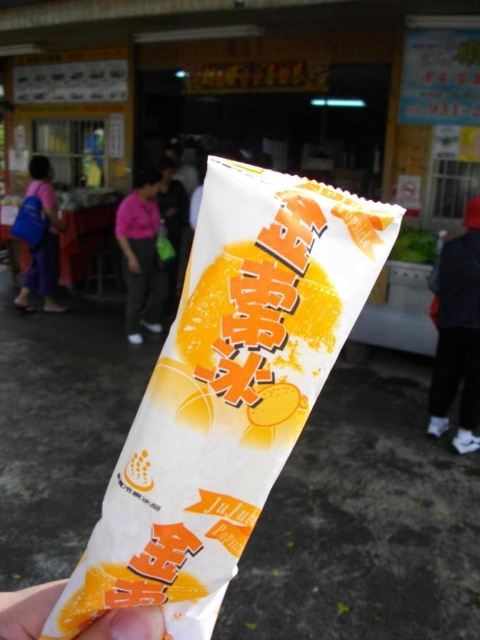
Which is more to the right, dark blue jeans at lower right or white paper at center?

From the viewer's perspective, dark blue jeans at lower right appears more on the right side.

Does dark blue jeans at lower right appear under white paper at center?

Actually, dark blue jeans at lower right is above white paper at center.

Between point (463, 244) and point (134, 632), which one is positioned behind?

Positioned behind is point (463, 244).

Locate an element on the screen. Image resolution: width=480 pixels, height=640 pixels. dark blue jeans at lower right is located at coordinates (457, 333).

Does pink fabric shirt at center have a lesser width compared to matte purple pants at lower left?

Correct, pink fabric shirt at center's width is less than matte purple pants at lower left's.

Who is shorter, pink fabric shirt at center or matte purple pants at lower left?

Standing shorter between the two is matte purple pants at lower left.

Who is more forward, (159,330) or (24,308)?

Point (159,330) is in front.

I want to click on pink fabric shirt at center, so click(x=141, y=253).

Does pink fabric shirt at center appear under white paper at center?

Incorrect, pink fabric shirt at center is not positioned below white paper at center.

Does pink fabric shirt at center have a larger size compared to white paper at center?

Yes, pink fabric shirt at center is bigger than white paper at center.

Between point (143, 323) and point (31, 620), which one is positioned behind?

Positioned behind is point (143, 323).

The height and width of the screenshot is (640, 480). Identify the location of pink fabric shirt at center. (141, 253).